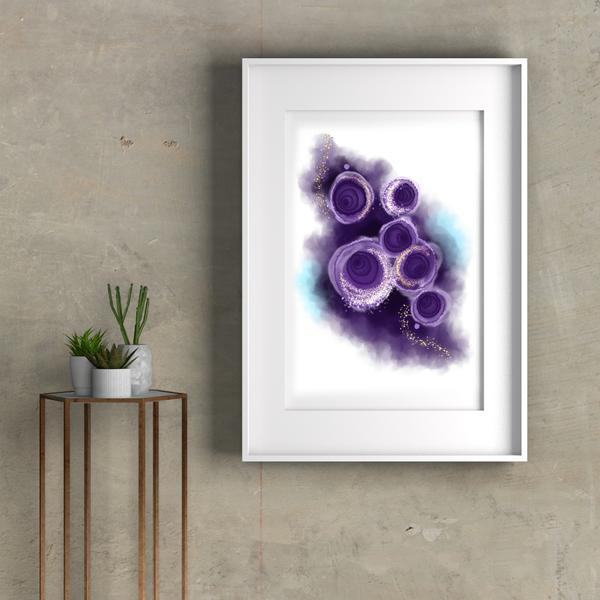
Where is `picture frame shadow`? picture frame shadow is located at coordinates 518,111, 228,161, 305,52.